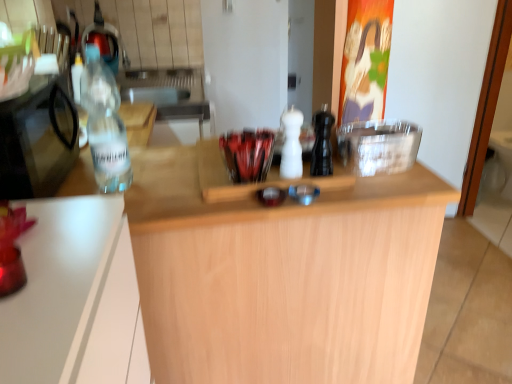
Image resolution: width=512 pixels, height=384 pixels. What are the coordinates of `free point below transparent plastic bottle at left, the first appliance from the left (from a real-world perspective)` in the screenshot? It's located at (50, 176).